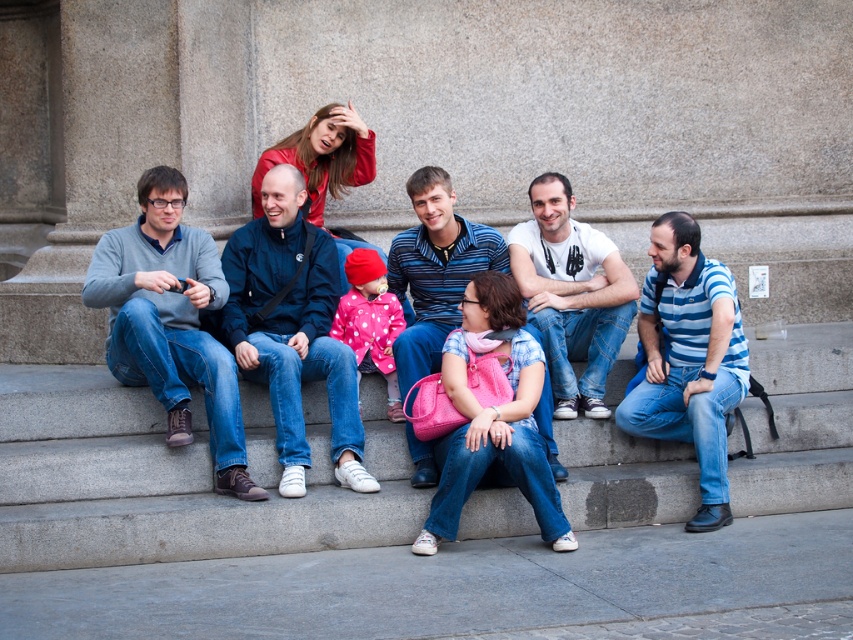
Does gray sweater at left lie behind striped polo shirt at center?

No, gray sweater at left is in front of striped polo shirt at center.

Where is `gray sweater at left`? The image size is (853, 640). gray sweater at left is located at coordinates (171, 321).

Locate an element on the screen. The height and width of the screenshot is (640, 853). gray sweater at left is located at coordinates (171, 321).

Can you confirm if blue denim jeans at center is positioned to the right of white t-shirt at center?

No, blue denim jeans at center is not to the right of white t-shirt at center.

Who is taller, blue denim jeans at center or white t-shirt at center?

blue denim jeans at center is taller.

Is point (352, 452) behind point (554, 298)?

No, it is not.

This screenshot has width=853, height=640. What are the coordinates of `blue denim jeans at center` in the screenshot? It's located at (292, 328).

Does blue denim jeans at center have a greater height compared to blue striped polo shirt at center?

Correct, blue denim jeans at center is much taller as blue striped polo shirt at center.

Is point (247, 246) in front of point (682, 246)?

No.

I want to click on blue denim jeans at center, so [x=292, y=328].